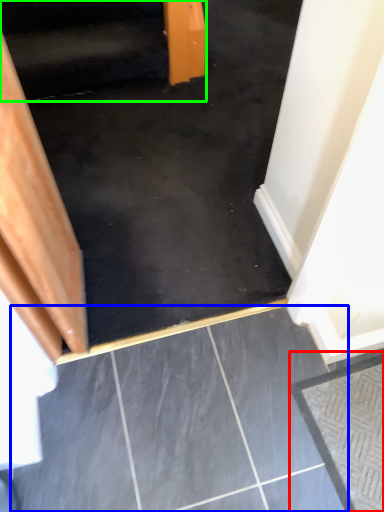
Question: Which is farther away from concrete (highlighted by a red box)? concrete (highlighted by a blue box) or stairwell (highlighted by a green box)?

Choices:
 (A) concrete
 (B) stairwell

Answer: (B)